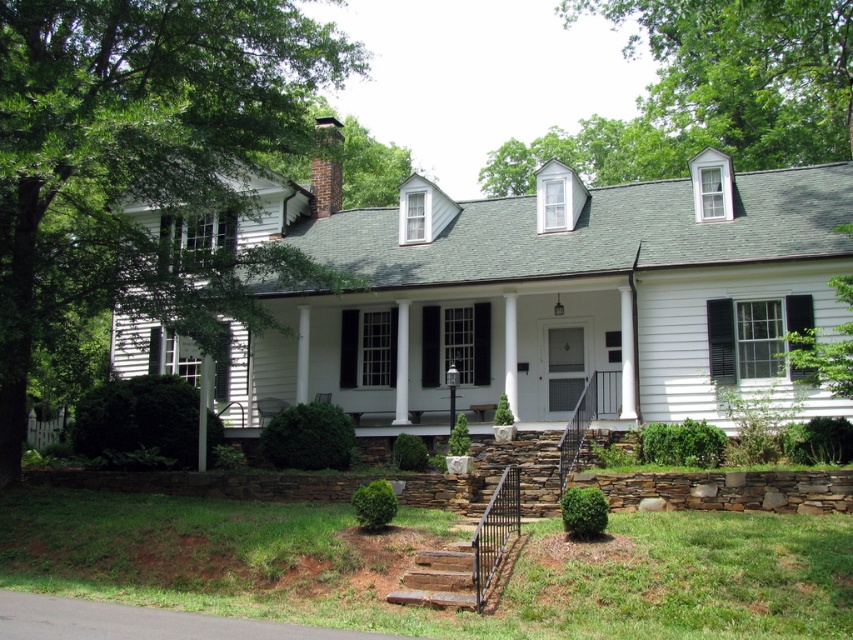
Question: Which point appears closest to the camera in this image?

Choices:
 (A) (323, 118)
 (B) (473, 605)

Answer: (B)

Question: Does white painted wood shutter at center lie behind brown brick chimney at upper center?

Choices:
 (A) no
 (B) yes

Answer: (B)

Question: Considering the relative positions of white painted wood shutter at center and brown brick chimney at upper center in the image provided, where is white painted wood shutter at center located with respect to brown brick chimney at upper center?

Choices:
 (A) below
 (B) above

Answer: (A)

Question: Which object is farther from the camera taking this photo?

Choices:
 (A) white painted wood shutter at center
 (B) brown brick chimney at upper center
 (C) wooden stairs at lower center

Answer: (A)

Question: Which point is closer to the camera?

Choices:
 (A) wooden stairs at lower center
 (B) white painted wood shutter at center

Answer: (A)

Question: Can you confirm if wooden stairs at lower center is bigger than brown brick chimney at upper center?

Choices:
 (A) yes
 (B) no

Answer: (B)